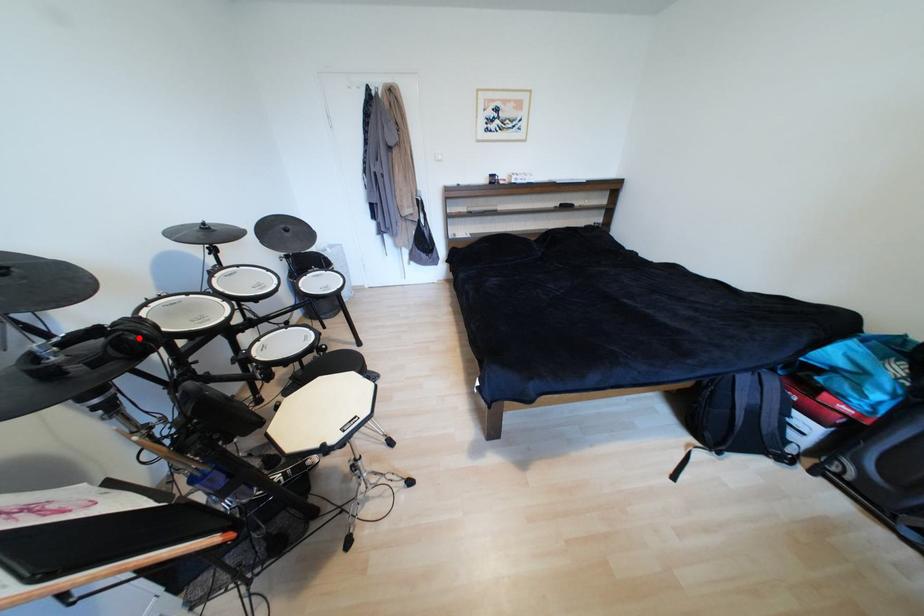
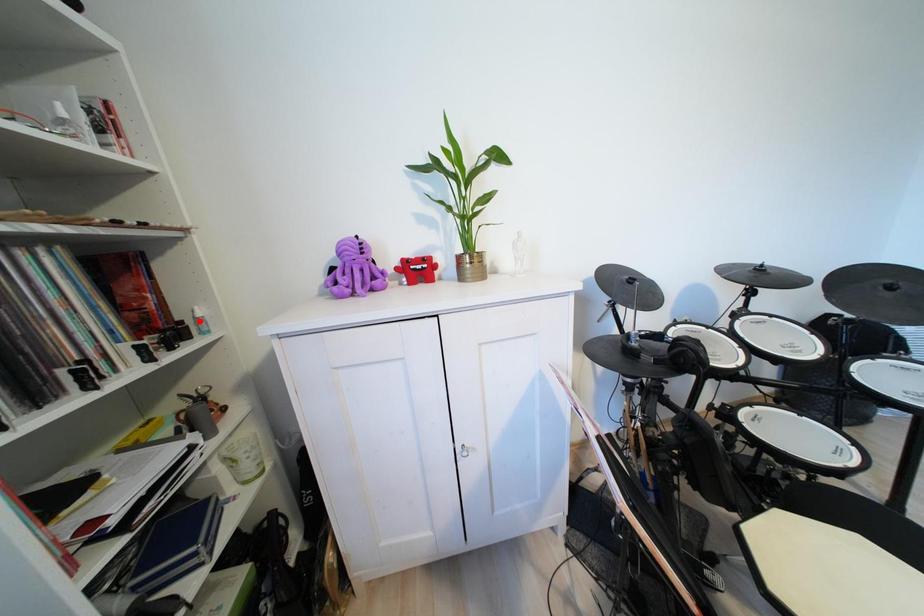
I am providing you with two images of the same scene from different viewpoints. A red point is marked on the first image and another point is marked on the second image. Does the point marked in image1 correspond to the same location as the one in image2?

No